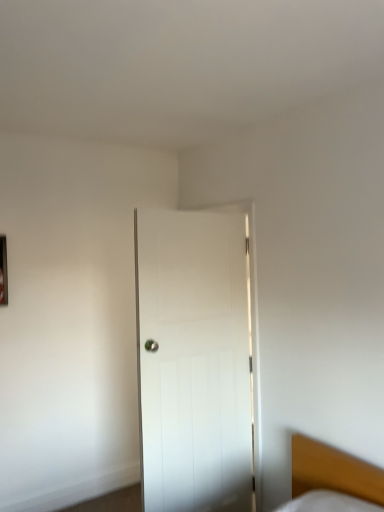
Question: Relative to white wooden door at center, is metallic rectangular frame at left in front or behind?

Choices:
 (A) behind
 (B) front

Answer: (A)

Question: From a real-world perspective, relative to white wooden door at center, is metallic rectangular frame at left vertically above or below?

Choices:
 (A) above
 (B) below

Answer: (A)

Question: Based on their relative distances, which object is farther from the wooden bed at lower right?

Choices:
 (A) white wooden door at center
 (B) metallic rectangular frame at left

Answer: (B)

Question: Which of these objects is positioned farthest from the white wooden door at center?

Choices:
 (A) wooden bed at lower right
 (B) metallic rectangular frame at left

Answer: (B)